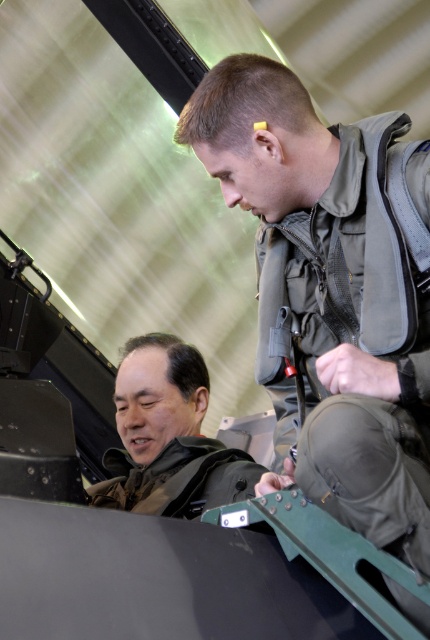
You are a military aircraft inspector checking the cockpit layout. You need to locate the matte green uniform at center. According to the coordinates provided, where exactly should you look in the cockpit?

The matte green uniform at center is located at coordinates point (328,296) in the cockpit.

You are a pilot preparing for takeoff and need to check the positions of the matte green uniform at center and the brown leather jacket at lower left. According to the cockpit layout, which object is positioned to the right of the other?

The matte green uniform at center is to the right of the brown leather jacket at lower left.